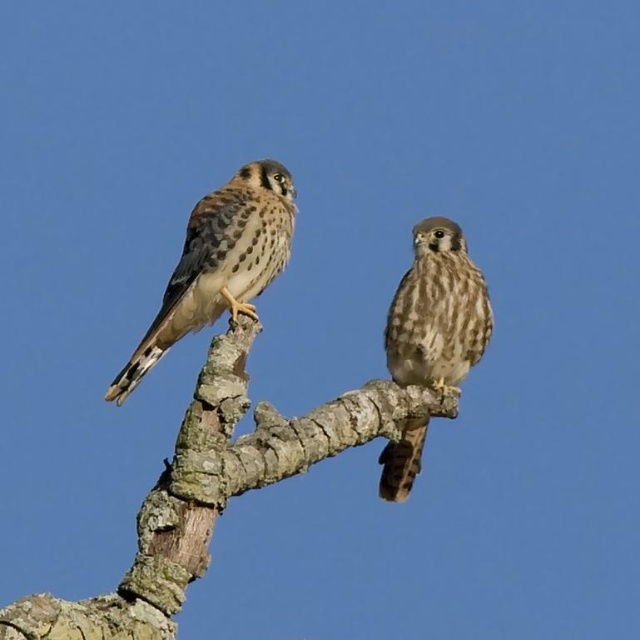
You are a birdwatcher observing two American Kestrels perched on a tree branch. You notice both have brown speckled feathers at left and brown speckled feathers at center. Which set of feathers is shorter?

The brown speckled feathers at left are shorter than the brown speckled feathers at center.

You are a birdwatcher trying to identify the tree branch where the American Kestrels are perched. According to the image, where is the brown rough tree branch at center located in terms of coordinates?

The brown rough tree branch at center is located at point [216,490].